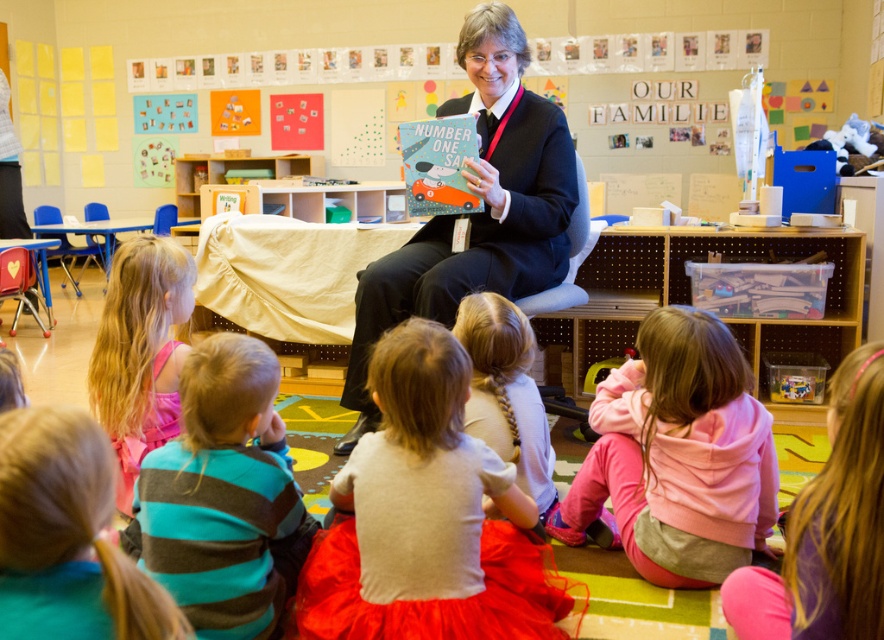
You are a teacher in the classroom and want to retrieve the white cotton tutu at center and the striped cotton shirt at lower left. Which item is closer to the floor?

The white cotton tutu at center is positioned under the striped cotton shirt at lower left, meaning it is closer to the floor than the striped cotton shirt at lower left.

You are a teacher in the classroom and you see the white cotton tutu at center. Where exactly is it located in the classroom?

The white cotton tutu at center is located at point (427,518) in the classroom.